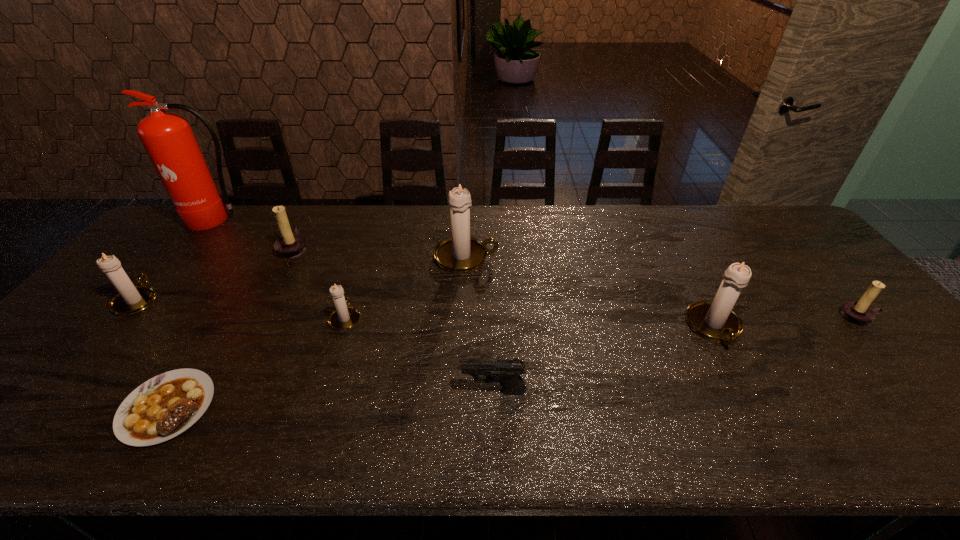
Where is `the smallest white candle holder`? the smallest white candle holder is located at coordinates (344, 317).

Where is `the fifth object from left to right`? the fifth object from left to right is located at coordinates (344, 317).

At what (x,y) coordinates should I click in order to perform the action: click on the nearer brown candle holder. Please return your answer as a coordinate pair (x, y). The width and height of the screenshot is (960, 540). Looking at the image, I should click on (859, 313).

Image resolution: width=960 pixels, height=540 pixels. In order to click on the rightmost candle holder in this screenshot , I will do `click(859, 313)`.

Locate an element on the screen. the eighth tallest object is located at coordinates (506, 371).

Locate an element on the screen. pistol is located at coordinates (506, 371).

Locate an element on the screen. This screenshot has height=540, width=960. steak is located at coordinates (166, 405).

The image size is (960, 540). In order to click on vacant space located towards the nozzle of the farthest object in this screenshot , I will do `click(167, 284)`.

Identify the location of vacant point located on the handle side of the biggest white candle holder. (579, 257).

This screenshot has height=540, width=960. Identify the location of vacant space situated on the handle side of the rightmost white candle holder. (768, 427).